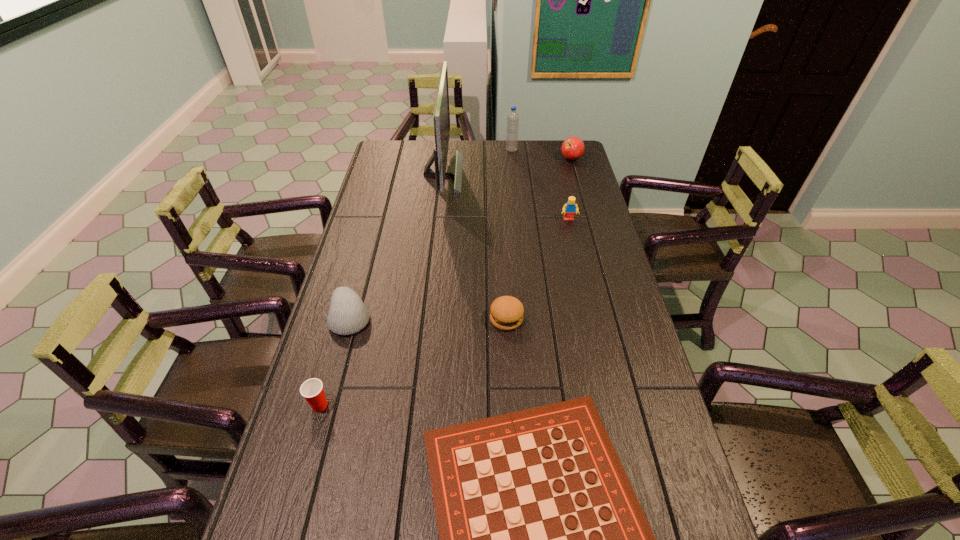
Identify the location of free space located on the front-facing side of the Lego. Image resolution: width=960 pixels, height=540 pixels. (578, 260).

Image resolution: width=960 pixels, height=540 pixels. Find the location of `vacant region located on the back of the beanie`. vacant region located on the back of the beanie is located at coordinates (370, 245).

Where is `free spot located 0.400m on the back of the Dixie cup`? Image resolution: width=960 pixels, height=540 pixels. free spot located 0.400m on the back of the Dixie cup is located at coordinates (353, 285).

Where is `vacant space located on the right of the hamburger`? vacant space located on the right of the hamburger is located at coordinates click(x=557, y=319).

Where is `monitor located at the far edge`? monitor located at the far edge is located at coordinates (441, 115).

The width and height of the screenshot is (960, 540). Find the location of `water bottle that is at the far edge`. water bottle that is at the far edge is located at coordinates (512, 129).

I want to click on apple that is positioned at the far edge, so click(572, 148).

Identify the location of beanie present at the left edge. pos(348,314).

This screenshot has width=960, height=540. In order to click on Dixie cup that is at the left edge in this screenshot , I will do `click(312, 390)`.

Locate an element on the screen. The image size is (960, 540). apple at the right edge is located at coordinates (572, 148).